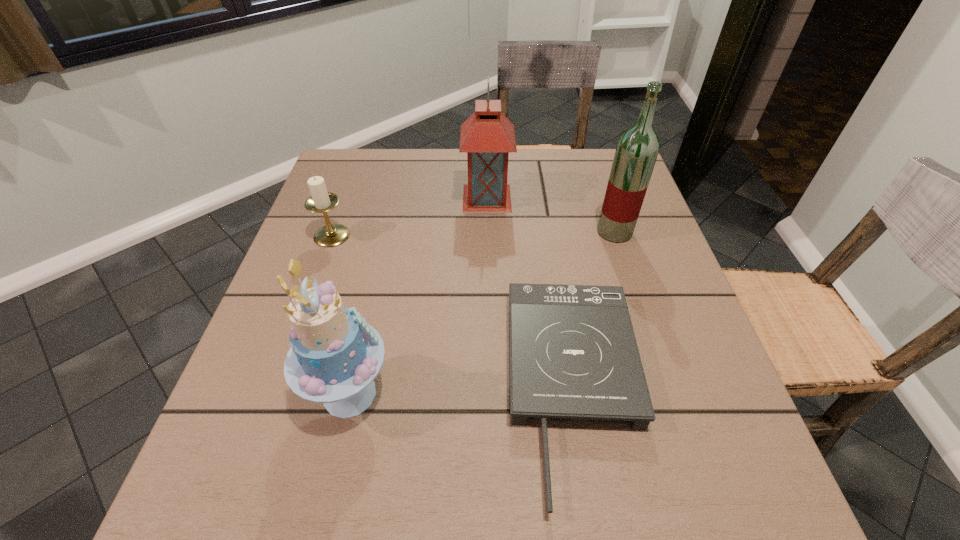
At what (x,y) coordinates should I click in order to perform the action: click on liquor. Please return your answer as a coordinate pair (x, y). Looking at the image, I should click on (637, 149).

Identify the location of lantern. 487,136.

The height and width of the screenshot is (540, 960). What are the coordinates of `cake` in the screenshot? It's located at (335, 356).

Where is `the leftmost object`? The image size is (960, 540). the leftmost object is located at coordinates (320, 201).

Locate an element on the screen. candle holder is located at coordinates (320, 201).

Where is `hotplate`? The width and height of the screenshot is (960, 540). hotplate is located at coordinates (573, 353).

Where is `free location located on the front of the liquor`? free location located on the front of the liquor is located at coordinates (669, 399).

I want to click on free space located on the right of the farthest object, so click(531, 198).

The image size is (960, 540). I want to click on vacant position located 0.400m with a ladder on the side of the cake, so click(631, 394).

Identify the location of free space located on the back of the leftmost object. The image size is (960, 540). (350, 184).